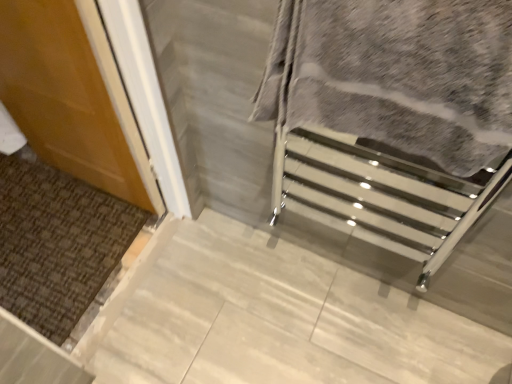
Question: Can you confirm if matte wood door at left is wider than gray textured towel at center?

Choices:
 (A) yes
 (B) no

Answer: (B)

Question: From the image's perspective, would you say matte wood door at left is shown under gray textured towel at center?

Choices:
 (A) no
 (B) yes

Answer: (A)

Question: From a real-world perspective, is matte wood door at left located higher than gray textured towel at center?

Choices:
 (A) no
 (B) yes

Answer: (A)

Question: From a real-world perspective, is matte wood door at left positioned under gray textured towel at center based on gravity?

Choices:
 (A) no
 (B) yes

Answer: (B)

Question: From the image's perspective, is matte wood door at left located above gray textured towel at center?

Choices:
 (A) yes
 (B) no

Answer: (A)

Question: Does matte wood door at left have a smaller size compared to gray textured towel at center?

Choices:
 (A) yes
 (B) no

Answer: (B)

Question: Is gray textured towel at center to the left of matte wood door at left from the viewer's perspective?

Choices:
 (A) yes
 (B) no

Answer: (B)

Question: From a real-world perspective, is gray textured towel at center physically below matte wood door at left?

Choices:
 (A) yes
 (B) no

Answer: (B)

Question: Is gray textured towel at center at the right side of matte wood door at left?

Choices:
 (A) no
 (B) yes

Answer: (B)

Question: Can you confirm if gray textured towel at center is shorter than matte wood door at left?

Choices:
 (A) yes
 (B) no

Answer: (A)

Question: Would you say gray textured towel at center is outside matte wood door at left?

Choices:
 (A) no
 (B) yes

Answer: (B)

Question: Does gray textured towel at center touch matte wood door at left?

Choices:
 (A) no
 (B) yes

Answer: (A)

Question: From a real-world perspective, is matte wood door at left physically located above or below gray textured towel at center?

Choices:
 (A) below
 (B) above

Answer: (A)